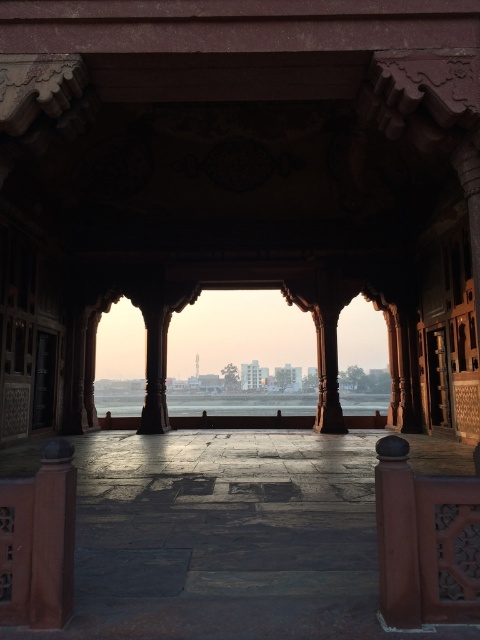
Question: Is smooth reddish-brown pillar at left closer to the viewer compared to transparent glass water at center?

Choices:
 (A) yes
 (B) no

Answer: (A)

Question: Based on their relative distances, which object is nearer to the smooth stone pillar at center?

Choices:
 (A) polished stone pillar at center
 (B) transparent glass water at center

Answer: (A)

Question: Can you confirm if smooth reddish-brown pillar at left is smaller than polished stone pillar at center?

Choices:
 (A) no
 (B) yes

Answer: (B)

Question: Can you confirm if smooth reddish-brown pillar at left is bigger than polished stone pillar at center?

Choices:
 (A) yes
 (B) no

Answer: (B)

Question: Based on their relative distances, which object is farther from the smooth reddish-brown pillar at left?

Choices:
 (A) polished stone pillar at center
 (B) transparent glass water at center

Answer: (B)

Question: Which point appears closest to the camera in this image?

Choices:
 (A) (179, 406)
 (B) (334, 381)

Answer: (B)